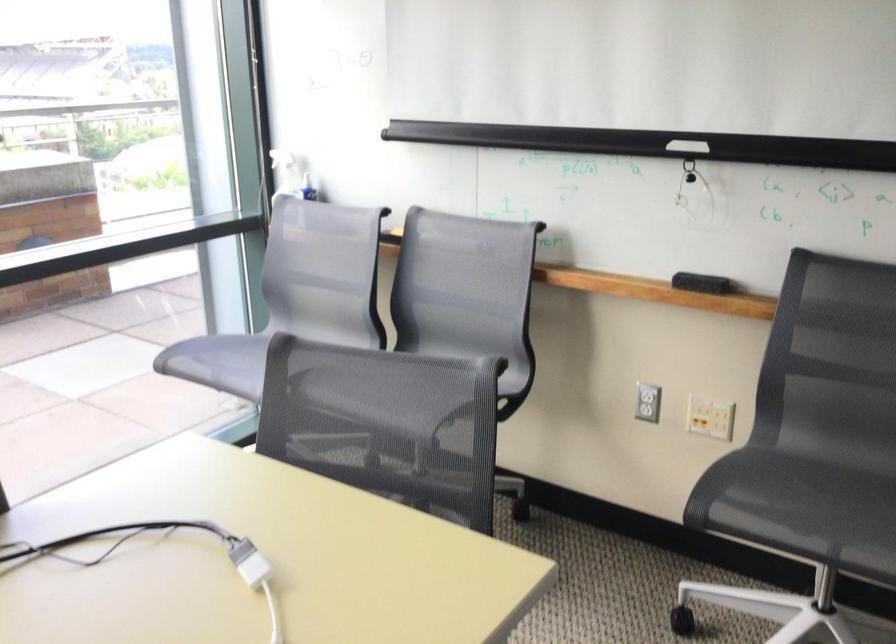
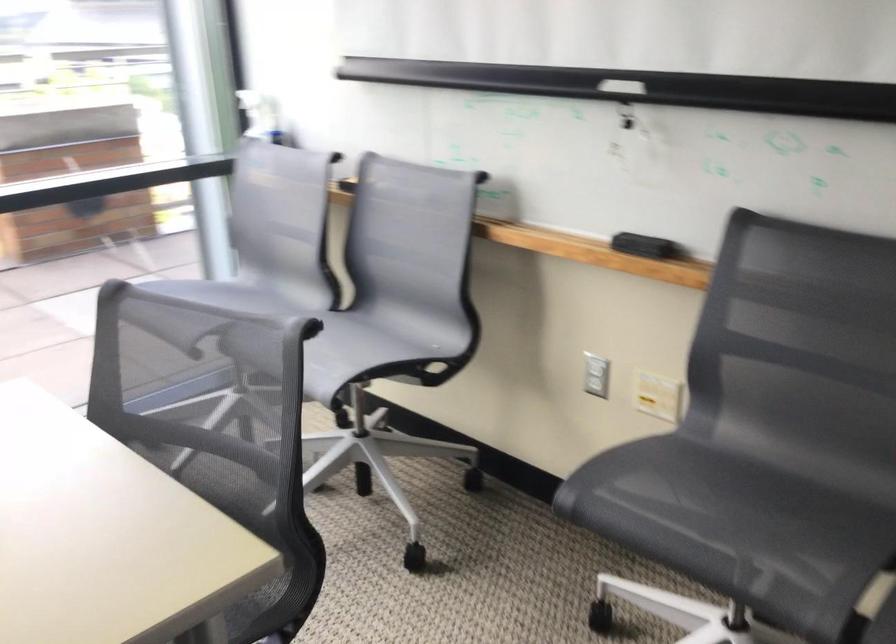
Question: I am providing you with two images of the same scene from different viewpoints. Which of the following objects are not visible in image2?

Choices:
 (A) chair handle cutout
 (B) grey mesh chair sitting surface
 (C) white light switch
 (D) green bottle trigger

Answer: (B)